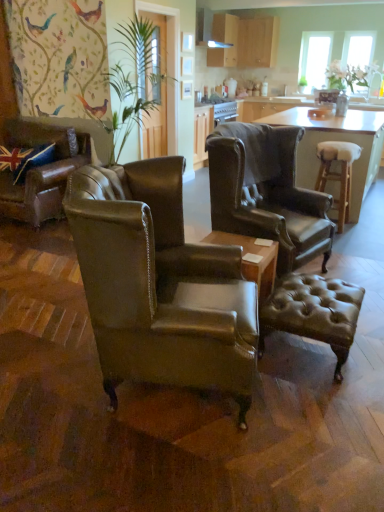
Question: From the image's perspective, is matte wood cabinets at upper center, arranged as the 2th cabinetry when viewed from the right, on translucent glass window at upper right, positioned as the first window screen in right-to-left order?

Choices:
 (A) yes
 (B) no

Answer: (A)

Question: Can you confirm if matte wood cabinets at upper center, arranged as the 1th cabinetry when viewed from the left, is positioned to the right of translucent glass window at upper right, positioned as the first window screen in right-to-left order?

Choices:
 (A) no
 (B) yes

Answer: (A)

Question: Is the position of matte wood cabinets at upper center, arranged as the 2th cabinetry when viewed from the right, more distant than that of translucent glass window at upper right, positioned as the first window screen in right-to-left order?

Choices:
 (A) yes
 (B) no

Answer: (B)

Question: From a real-world perspective, does matte wood cabinets at upper center, arranged as the 2th cabinetry when viewed from the right, sit lower than translucent glass window at upper right, the second window screen from the left?

Choices:
 (A) yes
 (B) no

Answer: (B)

Question: From a real-world perspective, is matte wood cabinets at upper center, arranged as the 2th cabinetry when viewed from the right, positioned over translucent glass window at upper right, the second window screen from the left, based on gravity?

Choices:
 (A) yes
 (B) no

Answer: (A)

Question: Looking at their shapes, would you say light brown wooden stool at right is wider or thinner than leather wingback chair at left, the first chair from the left?

Choices:
 (A) wide
 (B) thin

Answer: (B)

Question: In the image, is light brown wooden stool at right positioned in front of or behind leather wingback chair at left, the 1th chair positioned from the back?

Choices:
 (A) front
 (B) behind

Answer: (B)

Question: From the image's perspective, is light brown wooden stool at right above or below leather wingback chair at left, which is the 3th chair from right to left?

Choices:
 (A) above
 (B) below

Answer: (B)

Question: From a real-world perspective, relative to leather wingback chair at left, which ranks as the 3th chair in front-to-back order, is light brown wooden stool at right vertically above or below?

Choices:
 (A) below
 (B) above

Answer: (A)

Question: In the image, is leather wingback chair at center, marked as the 1th chair in a right-to-left arrangement, positioned in front of or behind wooden bar stool at right?

Choices:
 (A) front
 (B) behind

Answer: (A)

Question: From the image's perspective, is leather wingback chair at center, the 2th chair positioned from the back, positioned above or below wooden bar stool at right?

Choices:
 (A) above
 (B) below

Answer: (B)

Question: From a real-world perspective, is leather wingback chair at center, the 2th chair positioned from the back, above or below wooden bar stool at right?

Choices:
 (A) below
 (B) above

Answer: (B)

Question: Based on their sizes in the image, would you say leather wingback chair at center, marked as the 1th chair in a right-to-left arrangement, is bigger or smaller than wooden bar stool at right?

Choices:
 (A) small
 (B) big

Answer: (A)

Question: In the image, is wooden bar stool at right positioned in front of or behind brown leather ottoman at center?

Choices:
 (A) behind
 (B) front

Answer: (A)

Question: Is point (304, 109) positioned closer to the camera than point (312, 278)?

Choices:
 (A) closer
 (B) farther

Answer: (B)